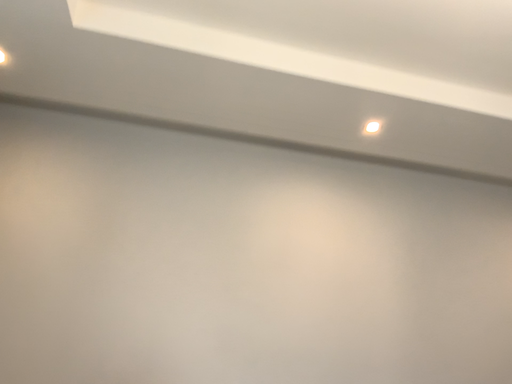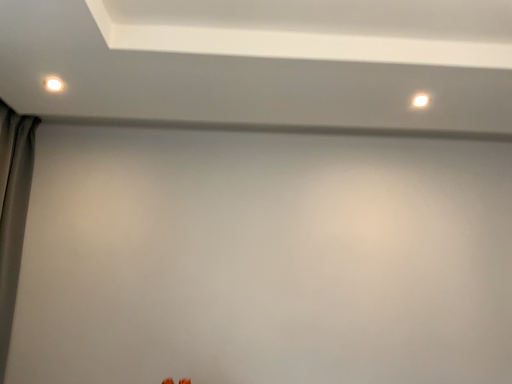
Question: How did the camera likely rotate when shooting the video?

Choices:
 (A) rotated right
 (B) rotated left

Answer: (B)